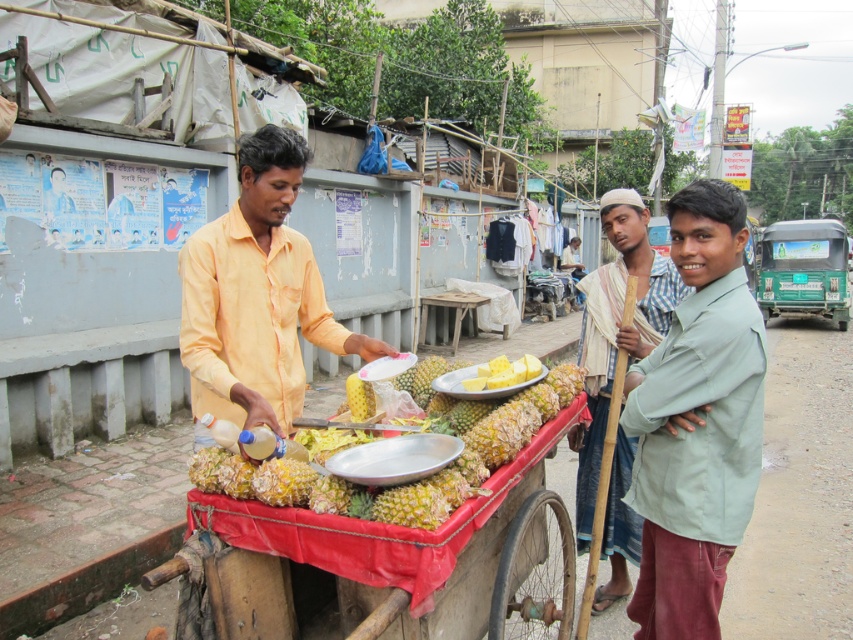
Between wooden cart at center and light green fabric shirt at right, which one is positioned lower?

wooden cart at center is below.

Who is more distant from viewer, [540,458] or [628,552]?

Point [628,552]

Does point (317, 534) lie behind point (606, 532)?

No, it is in front of (606, 532).

Find the location of a particular element. The height and width of the screenshot is (640, 853). wooden cart at center is located at coordinates pyautogui.click(x=373, y=525).

Who is positioned more to the right, light green fabric shirt at center or yellow cotton shirt at center?

From the viewer's perspective, light green fabric shirt at center appears more on the right side.

I want to click on light green fabric shirt at center, so click(x=695, y=420).

Between point (717, 182) and point (183, 349), which one is positioned behind?

Positioned behind is point (183, 349).

Where is `light green fabric shirt at center`? The image size is (853, 640). light green fabric shirt at center is located at coordinates (695, 420).

Can you confirm if wooden cart at center is smaller than yellow matte pineapple at center?

No.

Image resolution: width=853 pixels, height=640 pixels. What do you see at coordinates (373, 525) in the screenshot? I see `wooden cart at center` at bounding box center [373, 525].

The image size is (853, 640). In order to click on wooden cart at center in this screenshot , I will do `click(373, 525)`.